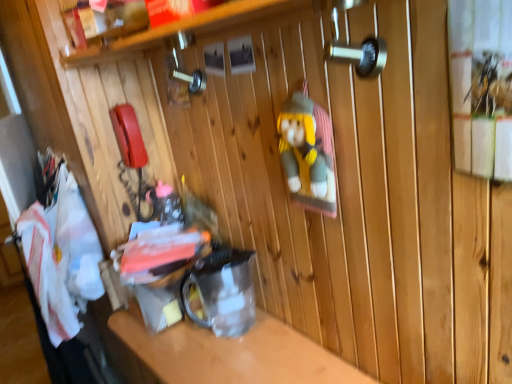
What do you see at coordinates (233, 353) in the screenshot? Image resolution: width=512 pixels, height=384 pixels. I see `clear plastic container at center` at bounding box center [233, 353].

Locate an element on the screen. This screenshot has width=512, height=384. clear plastic container at center is located at coordinates (233, 353).

The height and width of the screenshot is (384, 512). What do you see at coordinates (61, 253) in the screenshot?
I see `white fabric at left` at bounding box center [61, 253].

Where is `white fabric at left`? The height and width of the screenshot is (384, 512). white fabric at left is located at coordinates (61, 253).

This screenshot has height=384, width=512. Identify the location of clear plastic container at center. (233, 353).

Which object is positioned more to the right, clear plastic container at center or white fabric at left?

clear plastic container at center.

Is clear plastic container at center positioned in front of white fabric at left?

Yes, the depth of clear plastic container at center is less than that of white fabric at left.

Which is in front, point (274, 318) or point (65, 297)?

The point (274, 318) is closer.

From the image's perspective, between clear plastic container at center and white fabric at left, which one is located above?

white fabric at left is shown above in the image.

From a real-world perspective, between clear plastic container at center and white fabric at left, who is vertically lower?

clear plastic container at center, from a real-world perspective.

Considering the relative sizes of clear plastic container at center and white fabric at left in the image provided, is clear plastic container at center thinner than white fabric at left?

No, clear plastic container at center is not thinner than white fabric at left.

Looking at this image, can you confirm if clear plastic container at center is shorter than white fabric at left?

No.

Between clear plastic container at center and white fabric at left, which one has larger size?

Bigger between the two is clear plastic container at center.

Is white fabric at left located within clear plastic container at center?

No.

Is clear plastic container at center not close to white fabric at left?

Actually, clear plastic container at center and white fabric at left are a little close together.

Is clear plastic container at center looking in the opposite direction of white fabric at left?

No.

Identify the location of counter top below the white fabric at left (from a real-world perspective). (233, 353).

Which is more to the right, white fabric at left or clear plastic container at center?

clear plastic container at center is more to the right.

Is white fabric at left further to the viewer compared to clear plastic container at center?

Yes, the depth of white fabric at left is greater than that of clear plastic container at center.

Considering the points (84, 240) and (213, 356), which point is behind, point (84, 240) or point (213, 356)?

The point (84, 240) is behind.

From the image's perspective, which is below, white fabric at left or clear plastic container at center?

From the image's view, clear plastic container at center is below.

From a real-world perspective, is white fabric at left above or below clear plastic container at center?

From a real-world perspective, white fabric at left is physically above clear plastic container at center.

Which of these two, white fabric at left or clear plastic container at center, is wider?

Wider between the two is clear plastic container at center.

Does white fabric at left have a greater height compared to clear plastic container at center?

No, white fabric at left is not taller than clear plastic container at center.

Based on the photo, who is bigger, white fabric at left or clear plastic container at center?

clear plastic container at center is bigger.

Is clear plastic container at center surrounded by white fabric at left?

No, white fabric at left does not contain clear plastic container at center.

Based on the photo, is white fabric at left with clear plastic container at center?

white fabric at left and clear plastic container at center are not in contact.

Does white fabric at left turn towards clear plastic container at center?

No, white fabric at left is not facing towards clear plastic container at center.

The image size is (512, 384). Identify the location of laundry on the left of the clear plastic container at center. pos(61,253).

Locate an element on the screen. The width and height of the screenshot is (512, 384). counter top directly beneath the white fabric at left (from a real-world perspective) is located at coordinates (233, 353).

You are a GUI agent. You are given a task and a screenshot of the screen. Output one action in this format:
    pyautogui.click(x=<x>, y=<y>)
    Task: Click on the laundry that is above the clear plastic container at center (from the image's perspective)
    
    Given the screenshot: What is the action you would take?
    pyautogui.click(x=61, y=253)